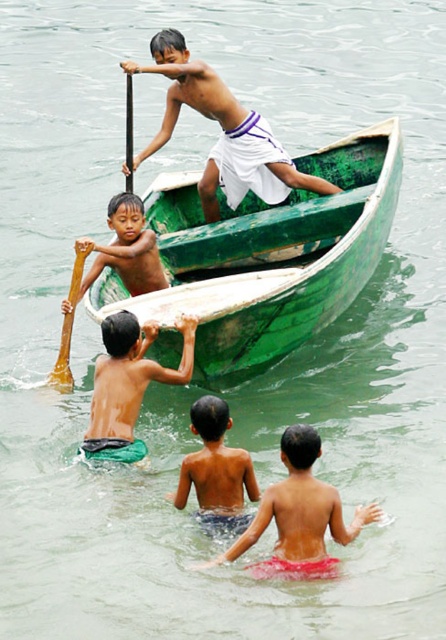
You are a photographer trying to capture a photo of the smooth skin boy at lower center and the light brown wooden paddle at upper left. Which object is shorter in the image?

The smooth skin boy at lower center is not as tall as the light brown wooden paddle at upper left, so the smooth skin boy at lower center is shorter.